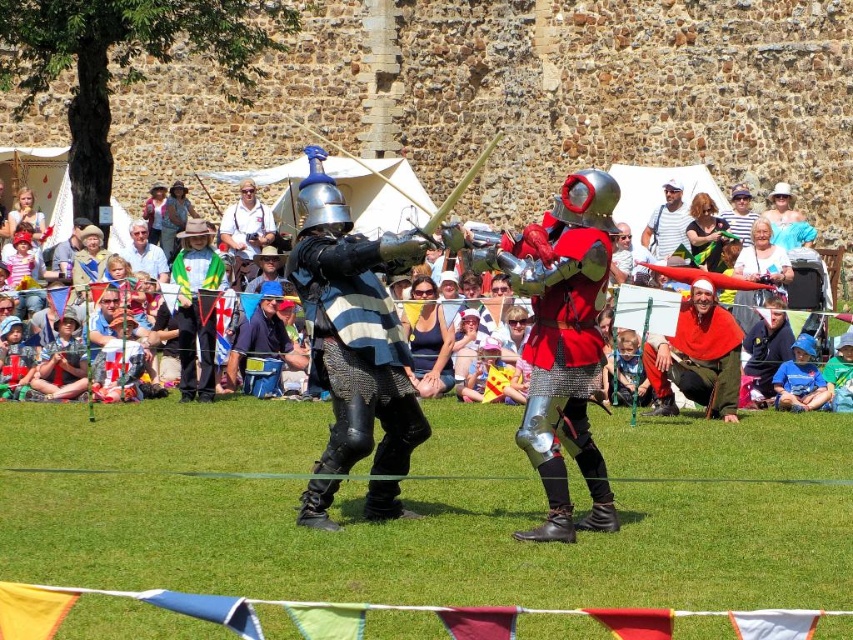
Question: Can you confirm if red fabric cape at center is positioned above matte black helmet at upper center?

Choices:
 (A) yes
 (B) no

Answer: (B)

Question: Does red fabric cape at center appear over matte black helmet at upper center?

Choices:
 (A) yes
 (B) no

Answer: (B)

Question: Estimate the real-world distances between objects in this image. Which object is closer to the red fabric cape at center?

Choices:
 (A) matte black helmet at upper center
 (B) matte white shirt at upper center
 (C) light brown leather jacket at center
 (D) shiny silver armor at center

Answer: (A)

Question: Does shiny silver armor at center have a greater width compared to matte white shirt at upper center?

Choices:
 (A) yes
 (B) no

Answer: (A)

Question: Which point is farther to the camera?

Choices:
 (A) red fabric cape at center
 (B) matte black helmet at upper center
 (C) matte white shirt at upper center

Answer: (C)

Question: Among these points, which one is farthest from the camera?

Choices:
 (A) (351, 342)
 (B) (625, 182)
 (C) (703, 336)
 (D) (137, 269)

Answer: (B)